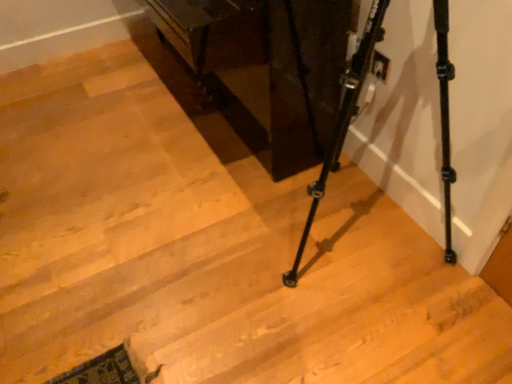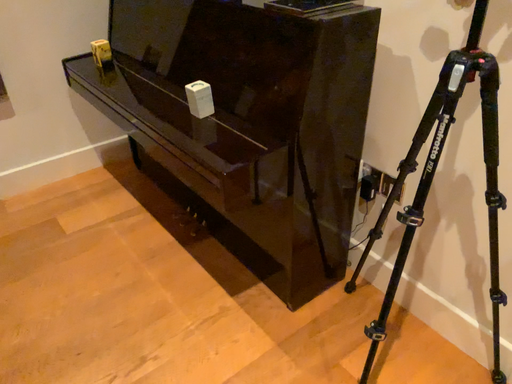
Question: Which way did the camera rotate in the video?

Choices:
 (A) rotated left
 (B) rotated right

Answer: (B)